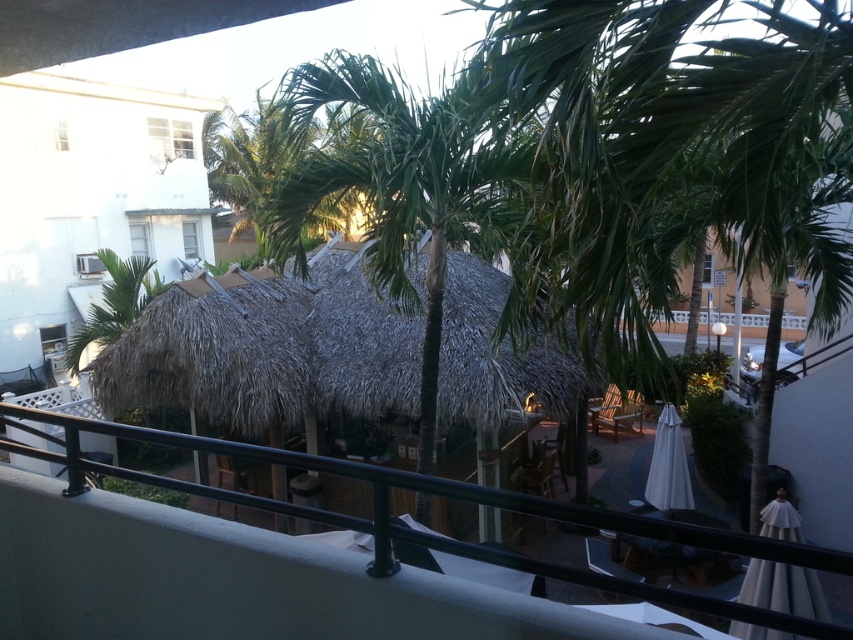
You are standing on the balcony and want to move from the thatched straw hut at center to the green leafy palm tree at center. Can you walk directly between them without any obstacles?

The distance between the thatched straw hut at center and the green leafy palm tree at center is 9.14 feet, so yes, you can walk directly between them as there is enough space.

You are standing on a balcony overlooking a tropical resort. You notice a thatched straw hut at center and a green leafy palm tree at center. Which object appears bigger in the scene?

The thatched straw hut at center appears bigger than the green leafy palm tree at center because it has a larger size compared to it.